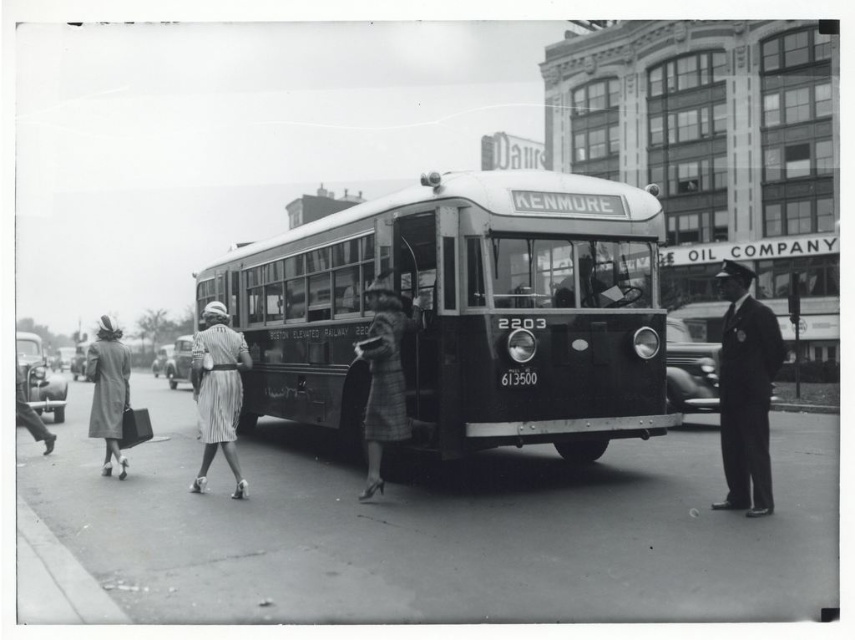
Question: Which point is closer to the camera?

Choices:
 (A) (128, 371)
 (B) (251, 291)
 (C) (203, 420)
 (D) (367, 464)

Answer: (C)

Question: Which point appears closest to the camera in this image?

Choices:
 (A) (99, 372)
 (B) (363, 346)
 (C) (201, 470)
 (D) (755, 342)

Answer: (D)

Question: Observing the image, what is the correct spatial positioning of dark uniform at right in reference to striped fabric dress at center?

Choices:
 (A) right
 (B) left

Answer: (A)

Question: Considering the relative positions of plaid wool skirt at center and striped fabric dress at center in the image provided, where is plaid wool skirt at center located with respect to striped fabric dress at center?

Choices:
 (A) below
 (B) above

Answer: (B)

Question: Which point is farther to the camera?

Choices:
 (A) matte gray coat at left
 (B) striped fabric dress at center
 (C) plaid wool skirt at center

Answer: (A)

Question: Is metallic silver bus at center thinner than striped fabric dress at center?

Choices:
 (A) yes
 (B) no

Answer: (B)